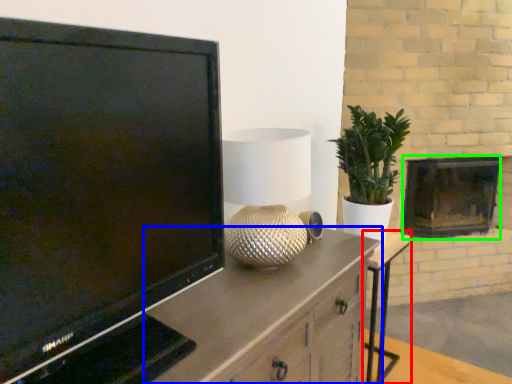
Question: Based on their relative distances, which object is nearer to table (highlighted by a red box)? Choose from cabinetry (highlighted by a blue box) and fireplace (highlighted by a green box).

Choices:
 (A) cabinetry
 (B) fireplace

Answer: (B)